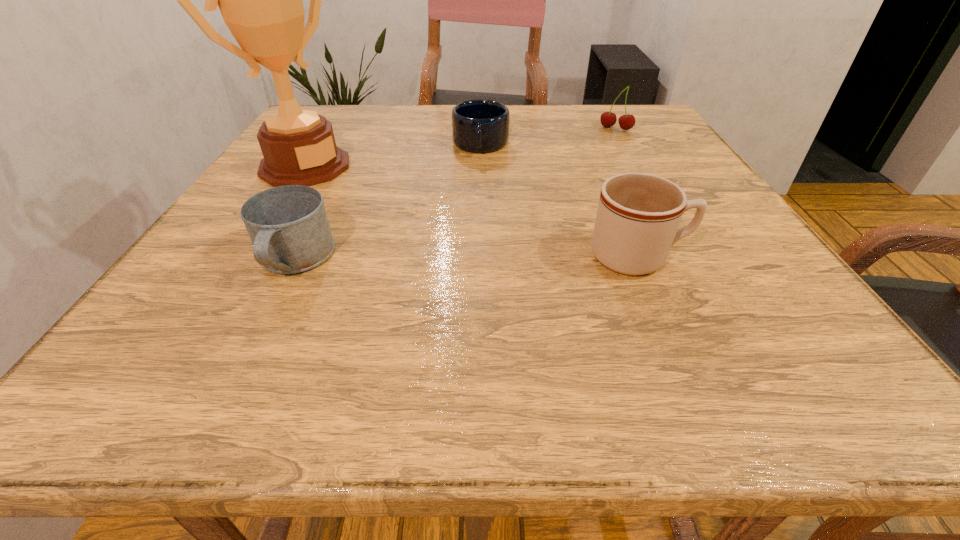
Identify the location of mug that is positioned at the right edge. (638, 216).

Identify the location of cherry located at the right edge. The height and width of the screenshot is (540, 960). 608,119.

Where is `object present at the near left corner`? The width and height of the screenshot is (960, 540). object present at the near left corner is located at coordinates (288, 226).

Find the location of a particular element. object situated at the far right corner is located at coordinates (608, 119).

The width and height of the screenshot is (960, 540). In order to click on vacant space at the far edge of the desktop in this screenshot , I will do `click(421, 133)`.

I want to click on vacant region at the near edge of the desktop, so click(580, 327).

This screenshot has width=960, height=540. In the image, there is a desktop. In order to click on vacant area at the left edge in this screenshot , I will do `click(252, 180)`.

The width and height of the screenshot is (960, 540). Find the location of `vacant space at the right edge of the desktop`. vacant space at the right edge of the desktop is located at coordinates (715, 272).

The width and height of the screenshot is (960, 540). Identify the location of vacant area at the far right corner. (673, 135).

The image size is (960, 540). Find the location of `vacant area between the shortest object and the leftmost mug`. vacant area between the shortest object and the leftmost mug is located at coordinates (388, 202).